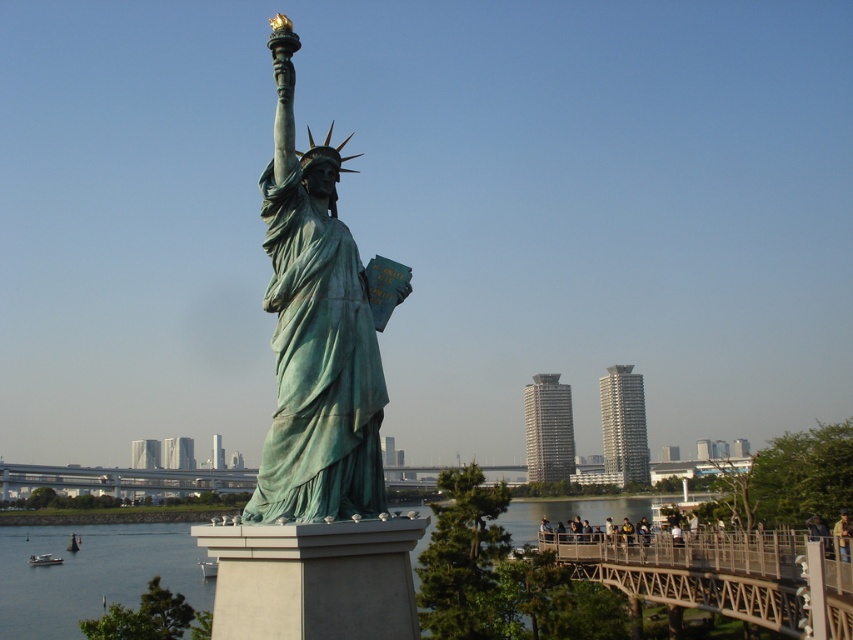
Question: Which is farther from the metallic gray bridge at center?

Choices:
 (A) green patina statue at center
 (B) green stone river at center
 (C) metallic gray bridge at lower right

Answer: (A)

Question: Observing the image, what is the correct spatial positioning of green stone river at center in reference to metallic gray bridge at center?

Choices:
 (A) below
 (B) above

Answer: (B)

Question: Which point is farther to the camera?

Choices:
 (A) (650, 579)
 (B) (386, 468)

Answer: (B)

Question: Is green stone river at center wider than metallic gray bridge at center?

Choices:
 (A) yes
 (B) no

Answer: (A)

Question: Among these points, which one is farthest from the camera?

Choices:
 (A) (647, 499)
 (B) (312, 202)
 (C) (405, 481)
 (D) (599, 573)

Answer: (A)

Question: Is green stone river at center below metallic gray bridge at lower right?

Choices:
 (A) yes
 (B) no

Answer: (A)